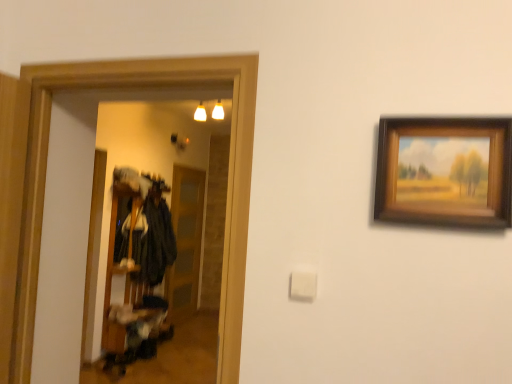
Question: Would you say transparent glass door at center is to the left or to the right of velvet black coat at center in the picture?

Choices:
 (A) left
 (B) right

Answer: (B)

Question: From their relative heights in the image, would you say transparent glass door at center is taller or shorter than velvet black coat at center?

Choices:
 (A) short
 (B) tall

Answer: (B)

Question: Considering the real-world distances, which object is farthest from the wooden picture frame at upper right?

Choices:
 (A) velvet black coat at center
 (B) transparent glass door at center

Answer: (B)

Question: Estimate the real-world distances between objects in this image. Which object is closer to the velvet black coat at center?

Choices:
 (A) transparent glass door at center
 (B) wooden picture frame at upper right

Answer: (A)